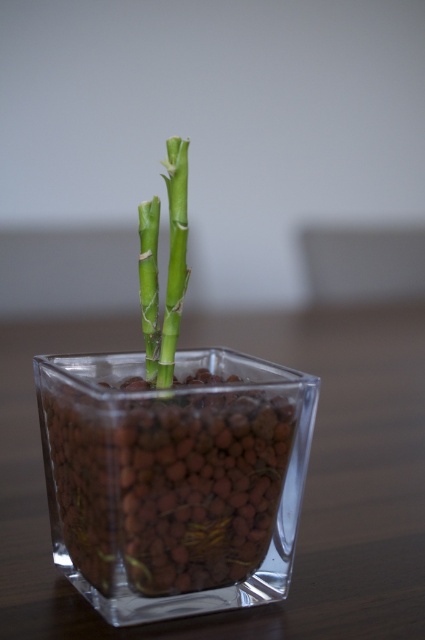
Looking at this image, between transparent glass vase at center and green matte bamboo at center, which one is positioned higher?

green matte bamboo at center is above.

In the scene shown: Does transparent glass vase at center have a greater width compared to green matte bamboo at center?

Indeed, transparent glass vase at center has a greater width compared to green matte bamboo at center.

You are a GUI agent. You are given a task and a screenshot of the screen. Output one action in this format:
    pyautogui.click(x=<x>, y=<y>)
    Task: Click on the transparent glass vase at center
    
    Given the screenshot: What is the action you would take?
    pyautogui.click(x=173, y=481)